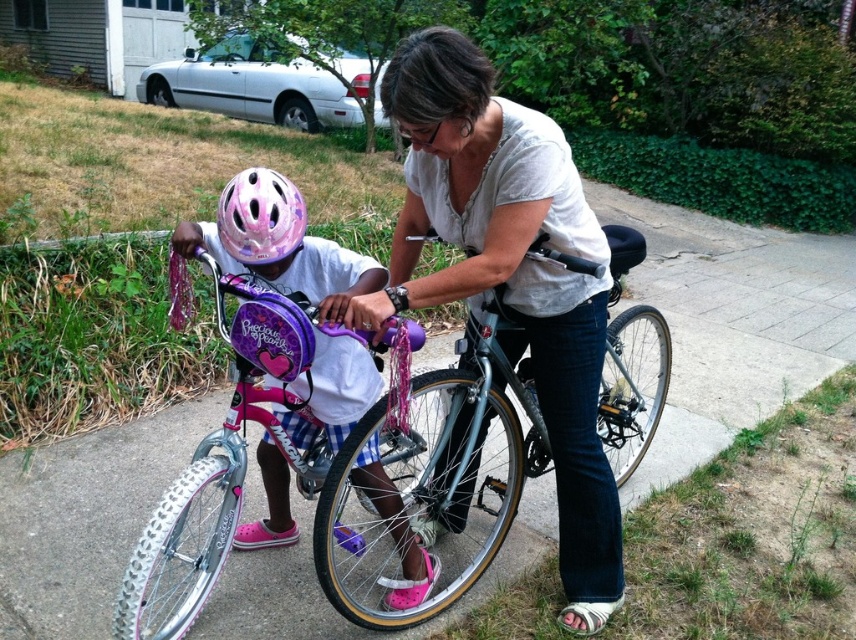
Is concrete at center thinner than pink matte bicycle at center?

No, concrete at center is not thinner than pink matte bicycle at center.

Does point (104, 636) come farther from viewer compared to point (232, 417)?

That is True.

The image size is (856, 640). Describe the element at coordinates (730, 323) in the screenshot. I see `concrete at center` at that location.

The image size is (856, 640). I want to click on concrete at center, so click(x=730, y=323).

Which is in front, point (277, 284) or point (236, 220)?

Point (236, 220)

Where is `pink glossy helmet at left`? This screenshot has width=856, height=640. pink glossy helmet at left is located at coordinates (278, 244).

Does concrete at center have a lesser width compared to matte white shirt at center?

In fact, concrete at center might be wider than matte white shirt at center.

Is concrete at center smaller than matte white shirt at center?

Actually, concrete at center might be larger than matte white shirt at center.

Who is more distant from viewer, (521, 556) or (581, 188)?

The point (521, 556) is behind.

What are the coordinates of `concrete at center` in the screenshot? It's located at (730, 323).